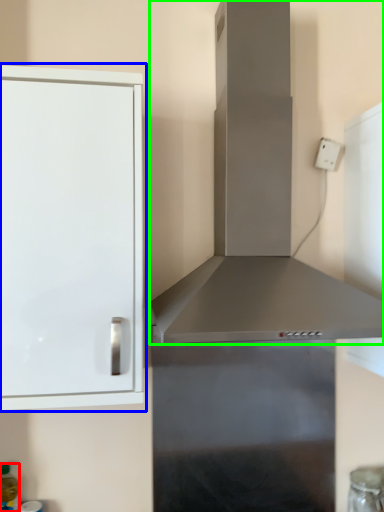
Question: Which object is the farthest from bottle (highlighted by a red box)? Choose among these: cabinetry (highlighted by a blue box) or vent (highlighted by a green box).

Choices:
 (A) cabinetry
 (B) vent

Answer: (B)